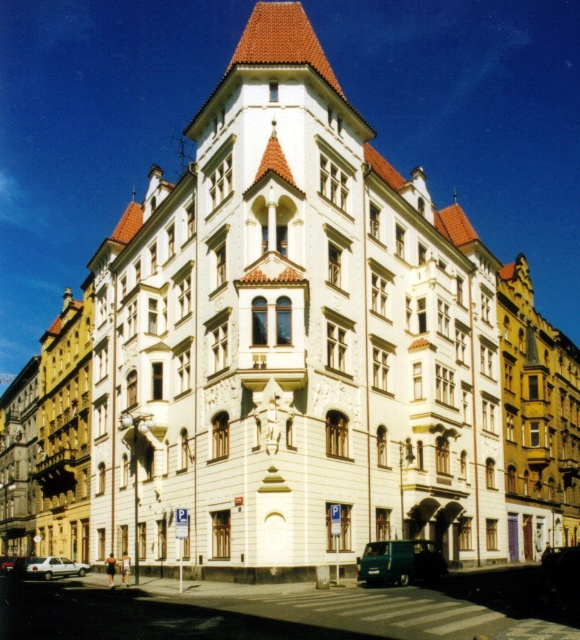
Question: Estimate the real-world distances between objects in this image. Which object is closer to the green matte van at lower center?

Choices:
 (A) white matte car at lower left
 (B) silver metallic car at lower left

Answer: (A)

Question: Is green matte van at lower center thinner than white matte car at lower left?

Choices:
 (A) yes
 (B) no

Answer: (A)

Question: Is the position of green matte van at lower center less distant than that of silver metallic car at lower left?

Choices:
 (A) no
 (B) yes

Answer: (B)

Question: Among these objects, which one is nearest to the camera?

Choices:
 (A) silver metallic car at lower left
 (B) green matte van at lower center
 (C) white matte car at lower left

Answer: (B)

Question: Which of the following is the closest to the observer?

Choices:
 (A) white matte car at lower left
 (B) green matte van at lower center
 (C) silver metallic car at lower left

Answer: (B)

Question: Is green matte van at lower center smaller than white matte car at lower left?

Choices:
 (A) no
 (B) yes

Answer: (B)